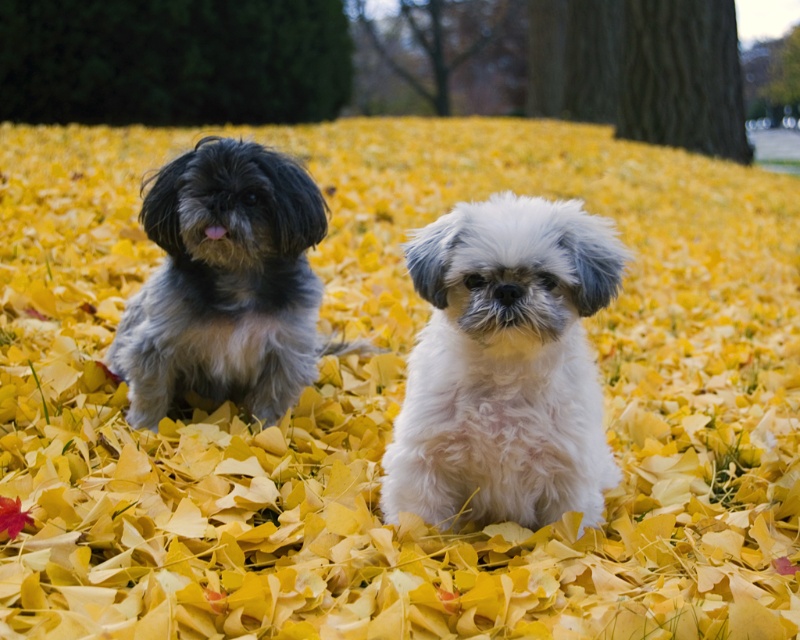
Question: Among these points, which one is nearest to the camera?

Choices:
 (A) (588, 445)
 (B) (314, 184)

Answer: (A)

Question: Is white fluffy dog at center above fluffy gray dog at left?

Choices:
 (A) yes
 (B) no

Answer: (B)

Question: Does white fluffy dog at center lie behind fluffy gray dog at left?

Choices:
 (A) yes
 (B) no

Answer: (B)

Question: Can you confirm if white fluffy dog at center is positioned below fluffy gray dog at left?

Choices:
 (A) no
 (B) yes

Answer: (B)

Question: Which point is closer to the camera?

Choices:
 (A) white fluffy dog at center
 (B) fluffy gray dog at left

Answer: (A)